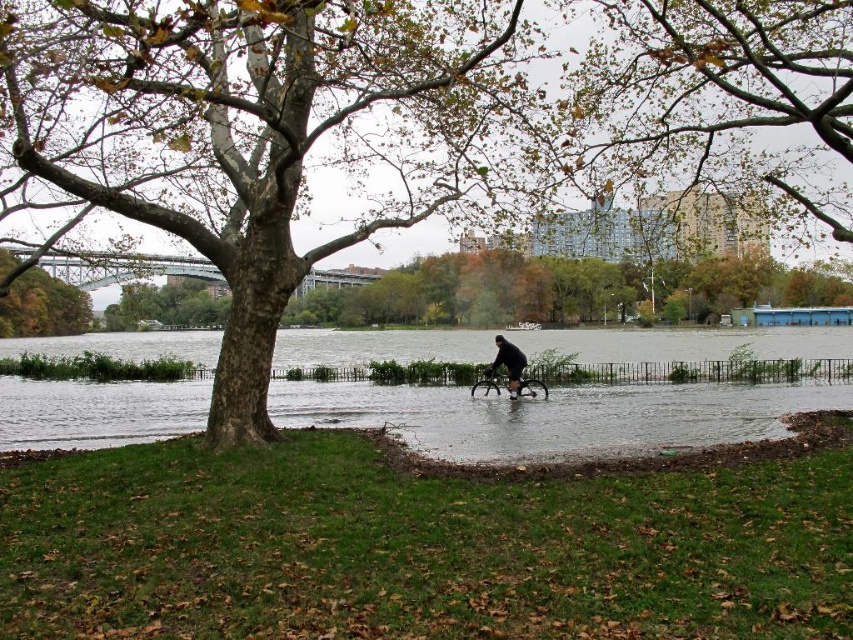
Looking at this image, who is shorter, brown matte tree at center or shiny black bicycle at center?

shiny black bicycle at center

Where is `brown matte tree at center`? The height and width of the screenshot is (640, 853). brown matte tree at center is located at coordinates (372, 122).

Consider the image. Is brown matte tree at upper left thinner than shiny black bicycle at center?

No.

Identify the location of brown matte tree at upper left. (44, 307).

Locate an element on the screen. This screenshot has height=640, width=853. brown matte tree at upper left is located at coordinates (44, 307).

At what (x,y) coordinates should I click in order to perform the action: click on brown matte tree at upper left. Please return your answer as a coordinate pair (x, y). Looking at the image, I should click on coord(44,307).

Does brown matte tree at center come behind black matte bicycle at center?

No, brown matte tree at center is closer to the viewer.

The width and height of the screenshot is (853, 640). In order to click on brown matte tree at center in this screenshot , I will do `click(372, 122)`.

Find the location of a particular element. brown matte tree at center is located at coordinates (372, 122).